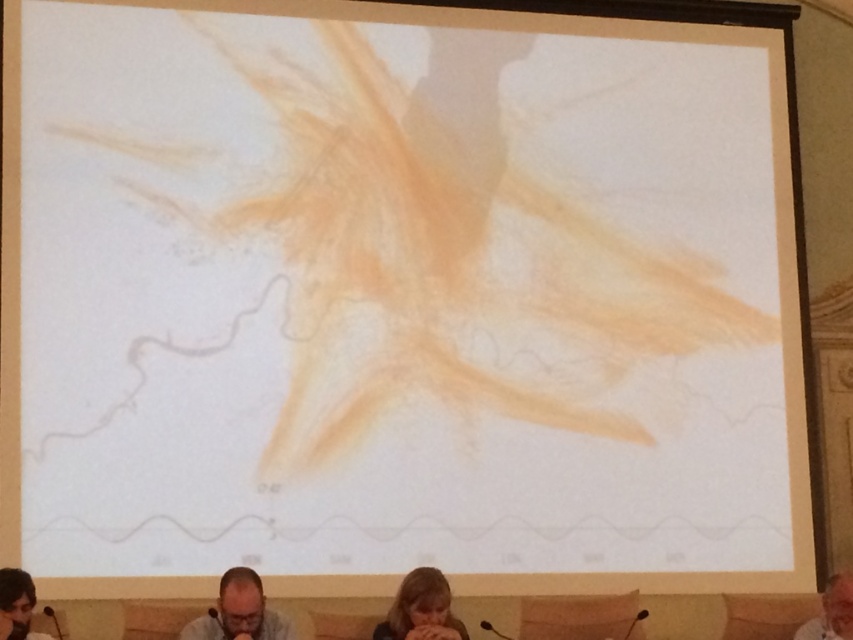
Question: Among these objects, which one is farthest from the camera?

Choices:
 (A) matte black microphone at lower left
 (B) blonde hair at lower center
 (C) gray matte shirt at lower center
 (D) gray hair at lower right

Answer: (D)

Question: Considering the real-world distances, which object is farthest from the gray hair at lower right?

Choices:
 (A) gray matte shirt at lower center
 (B) blonde hair at lower center

Answer: (A)

Question: Is blonde hair at lower center bigger than matte black microphone at lower left?

Choices:
 (A) yes
 (B) no

Answer: (A)

Question: Does matte black microphone at lower left come in front of gray hair at lower right?

Choices:
 (A) yes
 (B) no

Answer: (A)

Question: From the image, what is the correct spatial relationship of matte black microphone at lower left in relation to gray hair at lower right?

Choices:
 (A) above
 (B) below

Answer: (A)

Question: Among these points, which one is nearest to the camera?

Choices:
 (A) (387, 621)
 (B) (4, 621)
 (C) (813, 628)

Answer: (B)